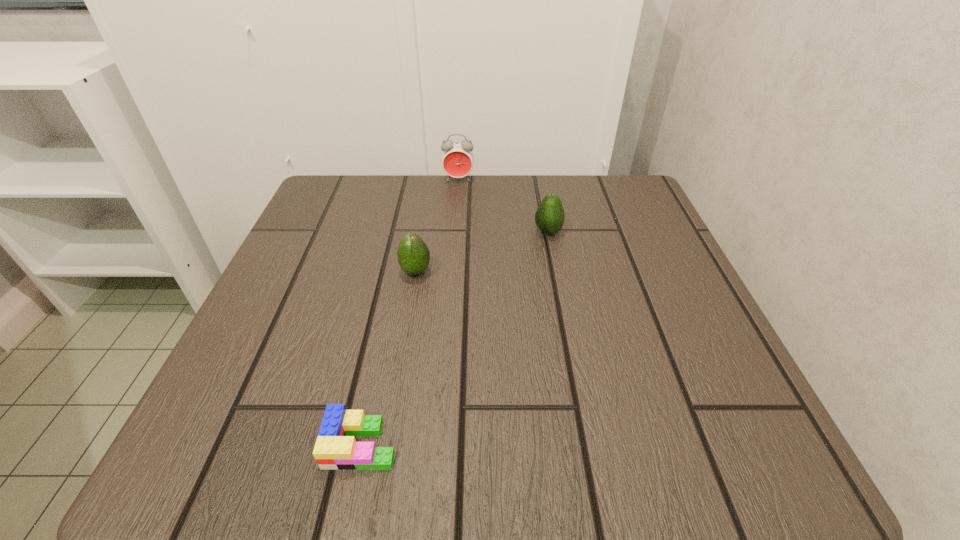
At what (x,y) coordinates should I click in order to perform the action: click on vacant space located 0.330m on the right of the nearer avocado. Please return your answer as a coordinate pair (x, y). Looking at the image, I should click on (612, 272).

This screenshot has width=960, height=540. I want to click on vacant space located on the back of the nearest object, so click(404, 241).

I want to click on alarm clock that is at the far edge, so click(x=457, y=158).

In order to click on avocado present at the far edge in this screenshot , I will do `click(549, 217)`.

Find the location of a particular element. The height and width of the screenshot is (540, 960). object that is at the near edge is located at coordinates (336, 448).

You are a GUI agent. You are given a task and a screenshot of the screen. Output one action in this format:
    pyautogui.click(x=<x>, y=<y>)
    Task: Click on the vacant area at the far edge of the desktop
    Image resolution: width=960 pixels, height=540 pixels.
    Given the screenshot: What is the action you would take?
    pyautogui.click(x=463, y=233)

In the image, there is a desktop. Identify the location of free space at the near edge. The width and height of the screenshot is (960, 540). (438, 411).

In the image, there is a desktop. Where is `free space at the left edge`? The height and width of the screenshot is (540, 960). free space at the left edge is located at coordinates (243, 397).

You are a GUI agent. You are given a task and a screenshot of the screen. Output one action in this format:
    pyautogui.click(x=<x>, y=<y>)
    Task: Click on the free spot at the right edge of the desktop
    The height and width of the screenshot is (540, 960).
    Given the screenshot: What is the action you would take?
    pyautogui.click(x=602, y=248)

In the image, there is a desktop. In order to click on free region at the far left corner in this screenshot , I will do `click(336, 212)`.